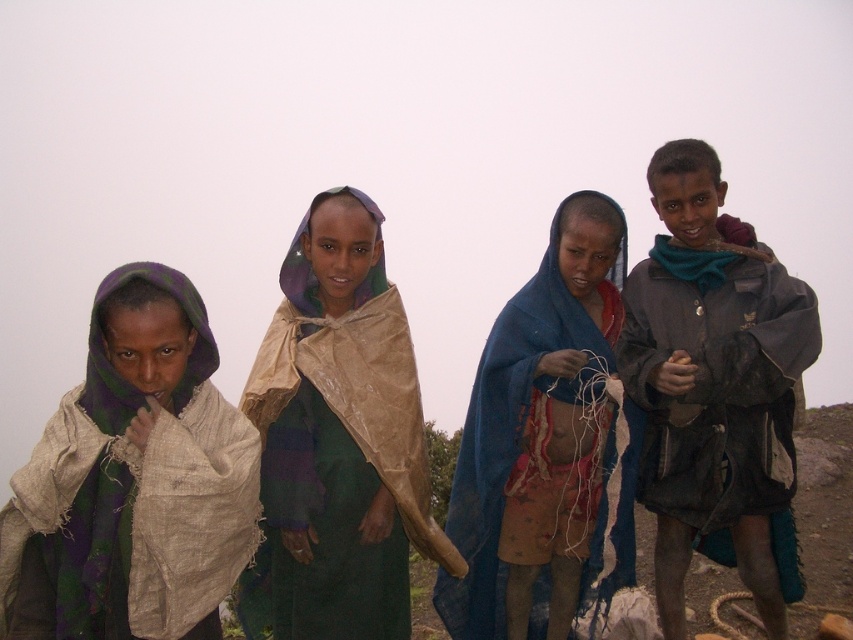
Question: Which object is farther from the camera taking this photo?

Choices:
 (A) dark gray jacket at right
 (B) blue sheer cloth at center
 (C) beige fabric scarf at left

Answer: (B)

Question: Can you confirm if green fabric wrapped at center is positioned below blue sheer cloth at center?

Choices:
 (A) no
 (B) yes

Answer: (A)

Question: Is green fabric wrapped at center closer to the viewer compared to blue sheer cloth at center?

Choices:
 (A) no
 (B) yes

Answer: (B)

Question: Which is farther from the dark gray jacket at right?

Choices:
 (A) beige fabric scarf at left
 (B) green fabric wrapped at center

Answer: (A)

Question: Estimate the real-world distances between objects in this image. Which object is farther from the beige fabric scarf at left?

Choices:
 (A) blue sheer cloth at center
 (B) dark gray jacket at right
 (C) green fabric wrapped at center

Answer: (B)

Question: Can you confirm if dark gray jacket at right is positioned above blue sheer cloth at center?

Choices:
 (A) yes
 (B) no

Answer: (A)